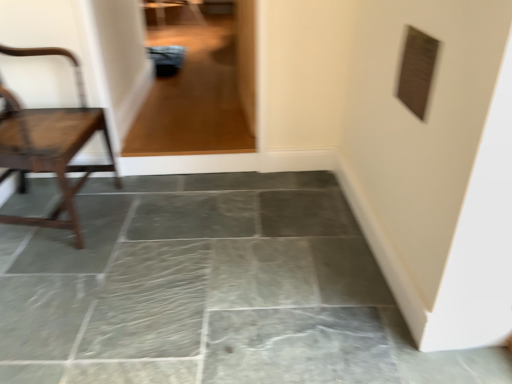
Describe the element at coordinates (50, 144) in the screenshot. The width and height of the screenshot is (512, 384). I see `wooden chair at left` at that location.

The image size is (512, 384). Identify the location of wooden chair at left. (50, 144).

The width and height of the screenshot is (512, 384). Find the location of `wooden chair at left`. wooden chair at left is located at coordinates (50, 144).

Is gray stone floor at center smaller than transparent glass door at upper center?

Actually, gray stone floor at center might be larger than transparent glass door at upper center.

Does point (35, 299) come behind point (245, 49)?

No.

Would you say transparent glass door at upper center is part of gray stone floor at center's contents?

That's incorrect, transparent glass door at upper center is not inside gray stone floor at center.

Consider the image. From a real-world perspective, which is physically below, gray stone floor at center or transparent glass door at upper center?

gray stone floor at center, from a real-world perspective.

Considering the sizes of objects wooden chair at left and gray stone floor at center in the image provided, who is shorter, wooden chair at left or gray stone floor at center?

gray stone floor at center is shorter.

Considering their positions, is wooden chair at left located in front of or behind gray stone floor at center?

wooden chair at left is behind gray stone floor at center.

From a real-world perspective, which is physically below, wooden chair at left or gray stone floor at center?

gray stone floor at center, from a real-world perspective.

In the image, is gray stone floor at center positioned in front of or behind wooden chair at left?

gray stone floor at center is in front of wooden chair at left.

How much distance is there between gray stone floor at center and wooden chair at left?

20.64 inches.

Is gray stone floor at center at the right side of wooden chair at left?

Indeed, gray stone floor at center is positioned on the right side of wooden chair at left.

From a real-world perspective, who is located higher, gray stone floor at center or wooden chair at left?

wooden chair at left, from a real-world perspective.

Which of these two, wooden chair at left or transparent glass door at upper center, stands shorter?

transparent glass door at upper center.

Looking at this image, from the image's perspective, would you say wooden chair at left is shown under transparent glass door at upper center?

Indeed, from the image's perspective, wooden chair at left is shown beneath transparent glass door at upper center.

Is wooden chair at left positioned beyond the bounds of transparent glass door at upper center?

Indeed, wooden chair at left is completely outside transparent glass door at upper center.

In the scene shown: How many degrees apart are the facing directions of transparent glass door at upper center and gray stone floor at center?

91.3 degrees.

From a real-world perspective, who is located higher, transparent glass door at upper center or gray stone floor at center?

In real-world perspective, transparent glass door at upper center is above.

Which object is positioned more to the left, transparent glass door at upper center or gray stone floor at center?

gray stone floor at center is more to the left.

Can you see transparent glass door at upper center touching gray stone floor at center?

No, transparent glass door at upper center is not next to gray stone floor at center.

From the image's perspective, does transparent glass door at upper center appear lower than wooden chair at left?

No, from the image's perspective, transparent glass door at upper center is not beneath wooden chair at left.

Where is `glass door located above the wooden chair at left (from a real-world perspective)`? The height and width of the screenshot is (384, 512). glass door located above the wooden chair at left (from a real-world perspective) is located at coordinates (247, 59).

Considering the relative sizes of transparent glass door at upper center and wooden chair at left in the image provided, is transparent glass door at upper center bigger than wooden chair at left?

Incorrect, transparent glass door at upper center is not larger than wooden chair at left.

Where is `concrete lying in front of the transparent glass door at upper center`? The width and height of the screenshot is (512, 384). concrete lying in front of the transparent glass door at upper center is located at coordinates click(197, 287).

Where is `chair above the gray stone floor at center (from a real-world perspective)`? This screenshot has width=512, height=384. chair above the gray stone floor at center (from a real-world perspective) is located at coordinates (50, 144).

Which object lies further to the anchor point gray stone floor at center, wooden chair at left or transparent glass door at upper center?

Based on the image, transparent glass door at upper center appears to be further to gray stone floor at center.

Considering their positions, is wooden chair at left positioned closer to transparent glass door at upper center than gray stone floor at center?

The object closer to transparent glass door at upper center is wooden chair at left.

From the image, which object appears to be nearer to transparent glass door at upper center, gray stone floor at center or wooden chair at left?

The object closer to transparent glass door at upper center is wooden chair at left.

Considering their positions, is transparent glass door at upper center positioned further to wooden chair at left than gray stone floor at center?

Among the two, transparent glass door at upper center is located further to wooden chair at left.

Estimate the real-world distances between objects in this image. Which object is further from wooden chair at left, gray stone floor at center or transparent glass door at upper center?

transparent glass door at upper center is positioned further to the anchor wooden chair at left.

Looking at the image, which one is located closer to gray stone floor at center, transparent glass door at upper center or wooden chair at left?

wooden chair at left lies closer to gray stone floor at center than the other object.

Locate an element on the screen. The image size is (512, 384). chair between transparent glass door at upper center and gray stone floor at center from top to bottom is located at coordinates (50, 144).